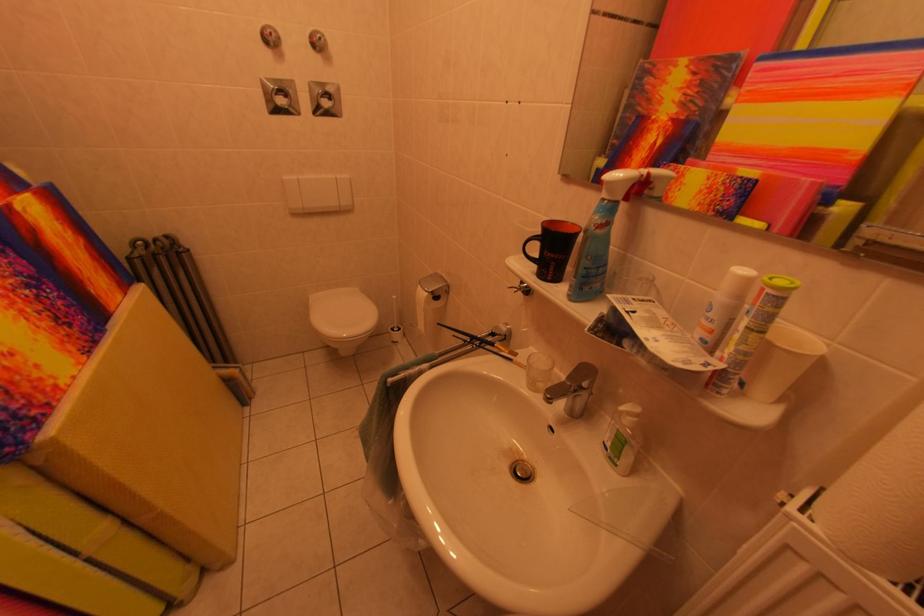
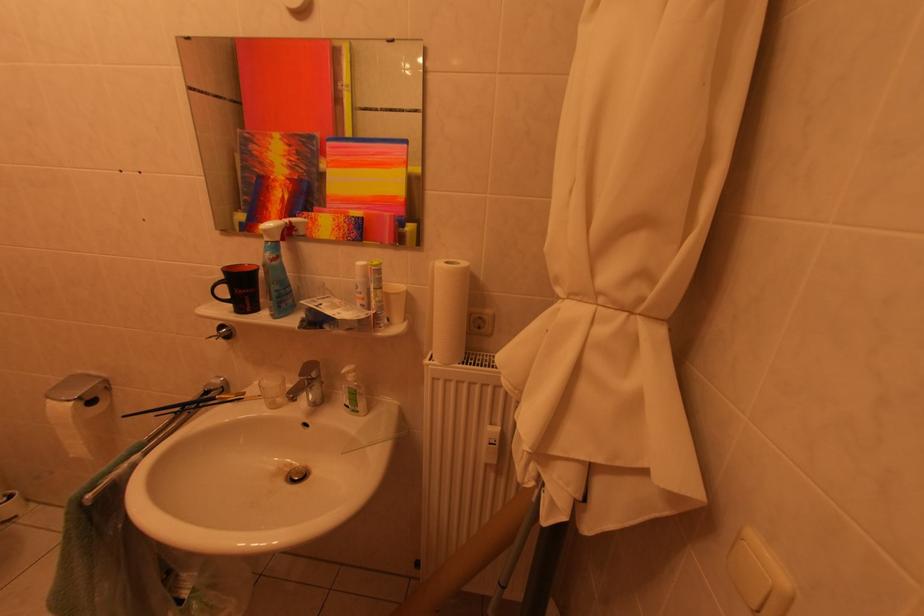
Question: The camera is either moving clockwise (left) or counter-clockwise (right) around the object. The first image is from the beginning of the video and the second image is from the end. Is the camera moving left or right when shooting the video?

Choices:
 (A) Left
 (B) Right

Answer: (A)